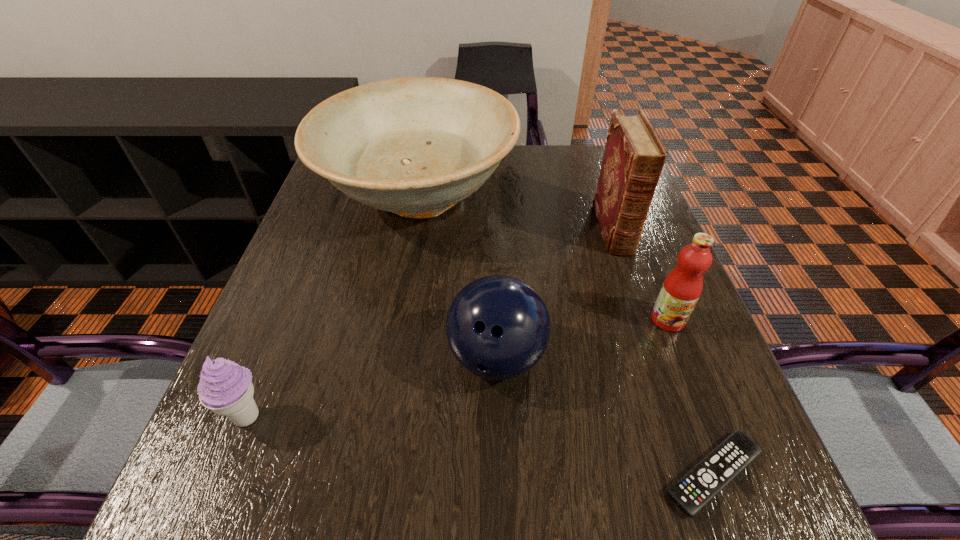
Where is `free space between the hardback book and the remote control`? This screenshot has width=960, height=540. free space between the hardback book and the remote control is located at coordinates (663, 352).

This screenshot has width=960, height=540. I want to click on vacant point located between the dish and the shortest object, so click(x=565, y=335).

Where is `free space between the icecream and the hardback book`? free space between the icecream and the hardback book is located at coordinates (430, 323).

The height and width of the screenshot is (540, 960). I want to click on free space between the hardback book and the dish, so click(x=516, y=213).

Identify the location of vacant area between the shortest object and the dish. This screenshot has height=540, width=960. (565, 335).

Identify which object is the fourth nearest to the icecream. Please provide its 2D coordinates. Your answer should be formatted as a tuple, i.e. [(x, y)], where the tuple contains the x and y coordinates of a point satisfying the conditions above.

[(681, 289)]

Select which object is the fourth closest to the hardback book. Please provide its 2D coordinates. Your answer should be formatted as a tuple, i.e. [(x, y)], where the tuple contains the x and y coordinates of a point satisfying the conditions above.

[(705, 480)]

Where is `free space that satisfies the following two spatial constraints: 1. on the front side of the remote control; 2. on the left side of the dish`? This screenshot has height=540, width=960. free space that satisfies the following two spatial constraints: 1. on the front side of the remote control; 2. on the left side of the dish is located at coordinates (370, 474).

Find the location of `vacant position in the image that satisfies the following two spatial constraints: 1. on the spine side of the hardback book; 2. on the left side of the shortest object`. vacant position in the image that satisfies the following two spatial constraints: 1. on the spine side of the hardback book; 2. on the left side of the shortest object is located at coordinates (696, 474).